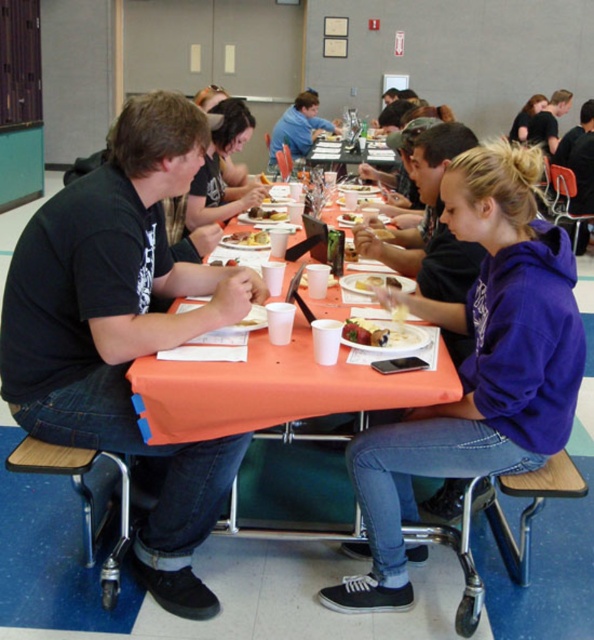
Who is more distant from viewer, (293, 336) or (403, 348)?

Positioned behind is point (293, 336).

Measure the distance between orange fabric table at center and camera.

A distance of 1.60 meters exists between orange fabric table at center and camera.

Who is more distant from viewer, (255, 385) or (350, 337)?

The point (350, 337) is behind.

This screenshot has width=594, height=640. I want to click on orange fabric table at center, so click(273, 388).

Is blue denim jeans at center closer to camera compared to smooth white plate at center?

No, blue denim jeans at center is further to the viewer.

In the scene shown: Between blue denim jeans at center and smooth white plate at center, which one has more height?

blue denim jeans at center

Is point (298, 132) behind point (358, 317)?

Yes, point (298, 132) is farther from viewer.

In order to click on blue denim jeans at center in this screenshot , I will do `click(298, 128)`.

What do you see at coordinates (124, 330) in the screenshot? I see `black matte shirt at left` at bounding box center [124, 330].

Who is more forward, (17, 289) or (258, 232)?

Point (17, 289) is more forward.

Locate an element on the screen. The width and height of the screenshot is (594, 640). black matte shirt at left is located at coordinates (124, 330).